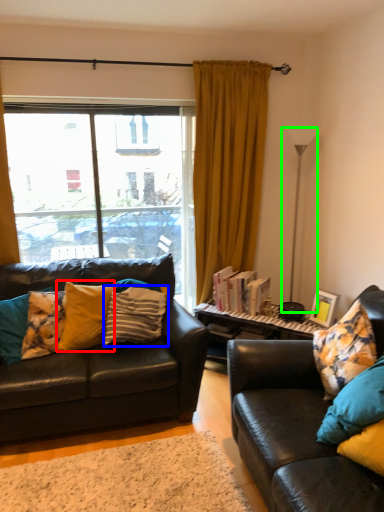
Question: Based on their relative distances, which object is nearer to pillow (highlighted by a red box)? Choose from pillow (highlighted by a blue box) and lamp (highlighted by a green box).

Choices:
 (A) pillow
 (B) lamp

Answer: (A)